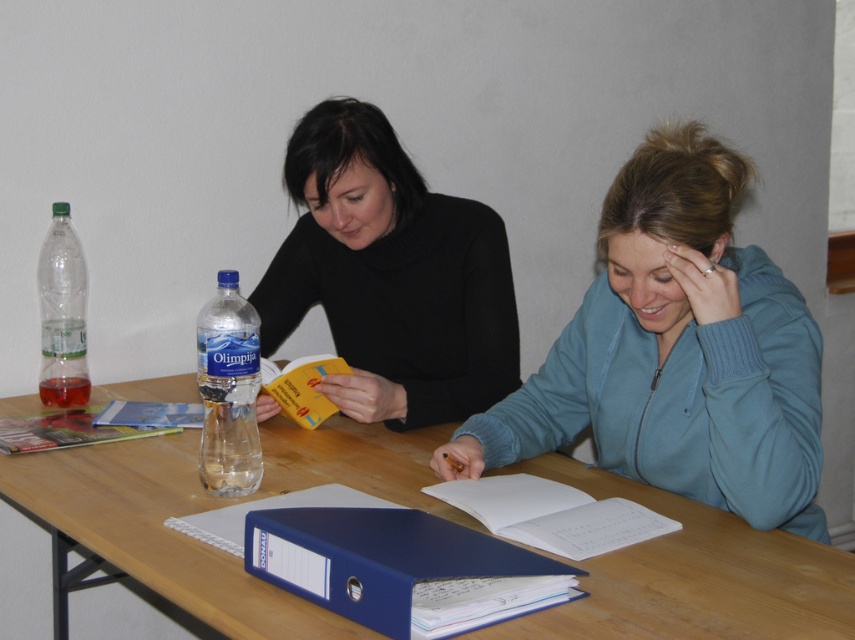
Which is behind, point (68, 362) or point (116, 438)?

The point (68, 362) is more distant.

Is transparent plastic bottle at left to the right of matte plastic book at left from the viewer's perspective?

In fact, transparent plastic bottle at left is to the left of matte plastic book at left.

This screenshot has width=855, height=640. Identify the location of transparent plastic bottle at left. (62, 314).

Where is `transparent plastic bottle at left`? transparent plastic bottle at left is located at coordinates (62, 314).

Between point (225, 294) and point (48, 305), which one is positioned behind?

Point (48, 305)

Does clear plastic bottle at center come in front of transparent plastic bottle at left?

Yes.

Is point (251, 486) in front of point (62, 323)?

Yes, it is.

This screenshot has height=640, width=855. I want to click on clear plastic bottle at center, so click(x=228, y=390).

Does blue fleece jacket at center right appear over matte plastic book at left?

Yes, blue fleece jacket at center right is above matte plastic book at left.

Is point (587, 355) less distant than point (155, 432)?

Yes.

I want to click on blue fleece jacket at center right, so click(677, 353).